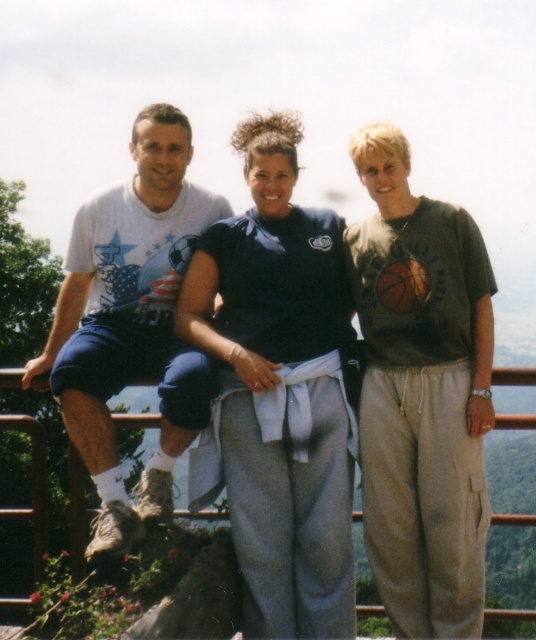
Question: Considering the relative positions of dark blue jersey at center and orange matte basketball at right in the image provided, where is dark blue jersey at center located with respect to orange matte basketball at right?

Choices:
 (A) below
 (B) above

Answer: (B)

Question: Which of the following is the farthest from the observer?

Choices:
 (A) (143, 332)
 (B) (232, 424)

Answer: (A)

Question: Which is farther from the white cotton t-shirt at left?

Choices:
 (A) dark blue cotton shirt at center
 (B) dark blue jersey at center
 (C) orange matte basketball at right

Answer: (A)

Question: Can you confirm if dark blue jersey at center is smaller than orange matte basketball at right?

Choices:
 (A) no
 (B) yes

Answer: (A)

Question: Does white cotton t-shirt at left have a greater width compared to orange matte basketball at right?

Choices:
 (A) yes
 (B) no

Answer: (A)

Question: Which point is closer to the camera?

Choices:
 (A) dark blue jersey at center
 (B) white cotton t-shirt at left

Answer: (B)